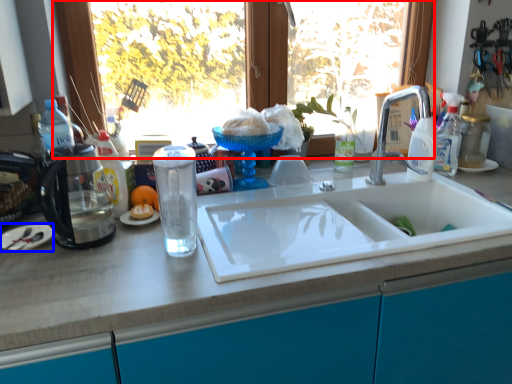
Question: Which object appears farthest to the camera in this image, window (highlighted by a red box) or plate (highlighted by a blue box)?

Choices:
 (A) window
 (B) plate

Answer: (A)